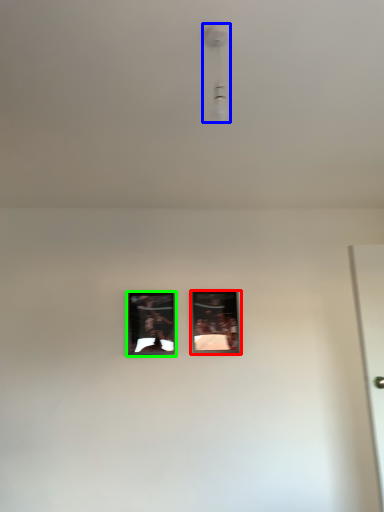
Question: Estimate the real-world distances between objects in this image. Which object is farther from picture frame (highlighted by a red box), light fixture (highlighted by a blue box) or picture frame (highlighted by a green box)?

Choices:
 (A) light fixture
 (B) picture frame

Answer: (A)